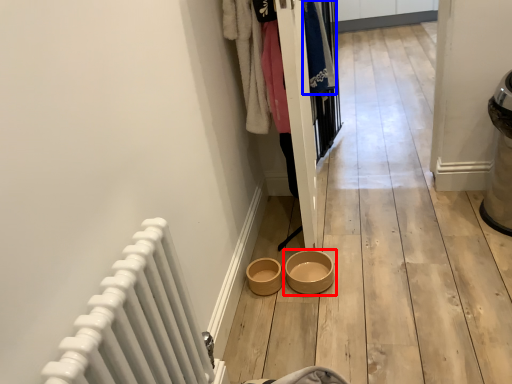
Question: Among these objects, which one is farthest to the camera, bowl (highlighted by a red box) or clothing (highlighted by a blue box)?

Choices:
 (A) bowl
 (B) clothing

Answer: (B)